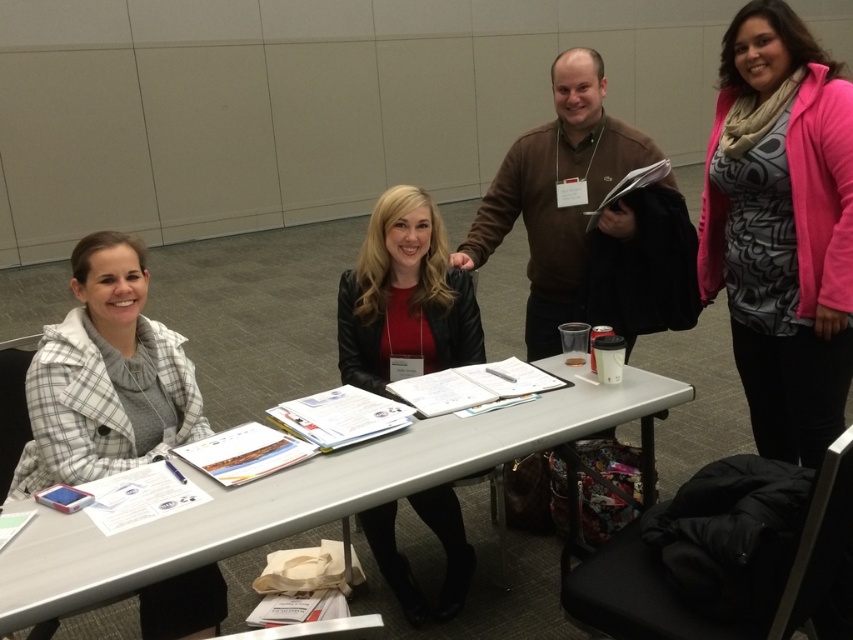
Question: Estimate the real-world distances between objects in this image. Which object is closer to the leather jacket at center?

Choices:
 (A) white plastic table at center
 (B) white plaid coat at left

Answer: (A)

Question: Which object is closer to the camera taking this photo?

Choices:
 (A) white plaid coat at left
 (B) white plastic table at center

Answer: (B)

Question: Observing the image, what is the correct spatial positioning of pink matte cardigan at upper right in reference to white plaid coat at left?

Choices:
 (A) below
 (B) above

Answer: (B)

Question: Which is nearer to the leather jacket at center?

Choices:
 (A) pink matte cardigan at upper right
 (B) white plaid coat at left
 (C) white plastic table at center

Answer: (C)

Question: Does pink matte cardigan at upper right appear on the right side of leather jacket at center?

Choices:
 (A) no
 (B) yes

Answer: (B)

Question: Considering the relative positions of pink matte cardigan at upper right and white plastic table at center in the image provided, where is pink matte cardigan at upper right located with respect to white plastic table at center?

Choices:
 (A) left
 (B) right

Answer: (B)